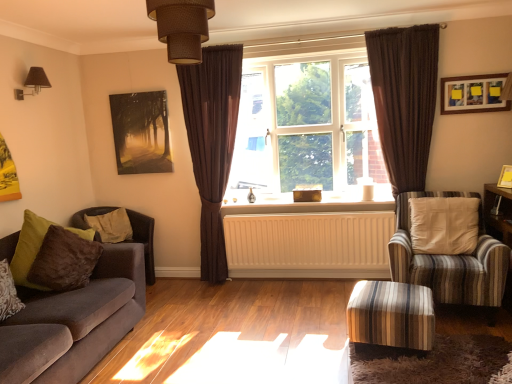
Question: Is brown fabric lampshade at upper left, acting as the first light fixture starting from the left, located within brown plush pillow at left, marked as the 2th pillow in a front-to-back arrangement?

Choices:
 (A) no
 (B) yes

Answer: (A)

Question: From the image's perspective, is brown plush pillow at left, the first pillow viewed from the back, located above brown fabric lampshade at upper left, acting as the first light fixture starting from the left?

Choices:
 (A) yes
 (B) no

Answer: (B)

Question: From a real-world perspective, is brown plush pillow at left, the first pillow viewed from the back, positioned over brown fabric lampshade at upper left, acting as the first light fixture starting from the left, based on gravity?

Choices:
 (A) no
 (B) yes

Answer: (A)

Question: Is brown plush pillow at left, the first pillow viewed from the back, turned away from brown fabric lampshade at upper left, placed as the 1th light fixture when sorted from back to front?

Choices:
 (A) no
 (B) yes

Answer: (A)

Question: Can you confirm if brown plush pillow at left, marked as the 2th pillow in a front-to-back arrangement, is shorter than brown fabric lampshade at upper left, which appears as the 2th light fixture when viewed from the front?

Choices:
 (A) yes
 (B) no

Answer: (B)

Question: Is brown plush pillow at left, marked as the 2th pillow in a front-to-back arrangement, further to the viewer compared to brown fabric lampshade at upper left, placed as the 1th light fixture when sorted from back to front?

Choices:
 (A) yes
 (B) no

Answer: (A)

Question: Does velvet brown armchair at left, which is counted as the 1th chair, starting from the left, have a greater height compared to matte black painting at upper left, which is the 3th picture frame in front-to-back order?

Choices:
 (A) yes
 (B) no

Answer: (A)

Question: Would you consider velvet brown armchair at left, which is counted as the 1th chair, starting from the left, to be distant from matte black painting at upper left, the 1th picture frame in the left-to-right sequence?

Choices:
 (A) no
 (B) yes

Answer: (A)

Question: From a real-world perspective, is velvet brown armchair at left, the 1th chair from the back, beneath matte black painting at upper left, the 1th picture frame in the left-to-right sequence?

Choices:
 (A) no
 (B) yes

Answer: (B)

Question: From the image's perspective, is velvet brown armchair at left, which appears as the 2th chair when viewed from the front, above matte black painting at upper left, which is the 1th picture frame in back-to-front order?

Choices:
 (A) yes
 (B) no

Answer: (B)

Question: Does velvet brown armchair at left, the 1th chair from the back, have a lesser height compared to matte black painting at upper left, the 1th picture frame in the left-to-right sequence?

Choices:
 (A) no
 (B) yes

Answer: (A)

Question: Is velvet brown armchair at left, which appears as the 2th chair when viewed from the front, to the left of matte black painting at upper left, arranged as the 3th picture frame when viewed from the right, from the viewer's perspective?

Choices:
 (A) yes
 (B) no

Answer: (A)

Question: Would you say velvet brown armchair at left, which is counted as the 1th chair, starting from the left, contains velvet sofa at left?

Choices:
 (A) yes
 (B) no

Answer: (B)